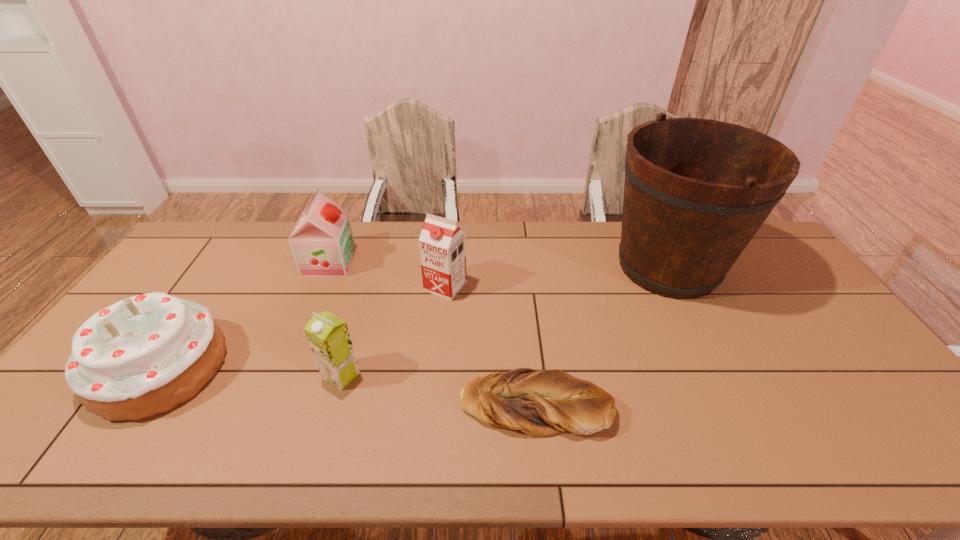
Locate an element on the screen. The width and height of the screenshot is (960, 540). the rightmost object is located at coordinates (696, 191).

Where is `the tallest object`? The height and width of the screenshot is (540, 960). the tallest object is located at coordinates (696, 191).

Identify the location of the rightmost soya milk. Image resolution: width=960 pixels, height=540 pixels. (442, 245).

This screenshot has width=960, height=540. I want to click on the fifth object from right to left, so click(322, 243).

Find the location of a particular element. This screenshot has width=960, height=540. cake is located at coordinates (145, 355).

Identify the location of the fourth object from right to left. (328, 336).

Locate an element on the screen. This screenshot has height=540, width=960. the nearest soya milk is located at coordinates (328, 336).

You are a GUI agent. You are given a task and a screenshot of the screen. Output one action in this format:
    pyautogui.click(x=<x>, y=<y>)
    Task: Click on the shortest object
    
    Given the screenshot: What is the action you would take?
    pyautogui.click(x=539, y=403)

You are a GUI agent. You are given a task and a screenshot of the screen. Output one action in this format:
    pyautogui.click(x=<x>, y=<y>)
    Task: Click on the free point located 0.310m on the front of the tallest object
    This screenshot has height=540, width=960.
    Given the screenshot: What is the action you would take?
    pyautogui.click(x=737, y=404)

Identify the location of vacant space located 0.070m on the left of the rightmost soya milk. [x=402, y=286].